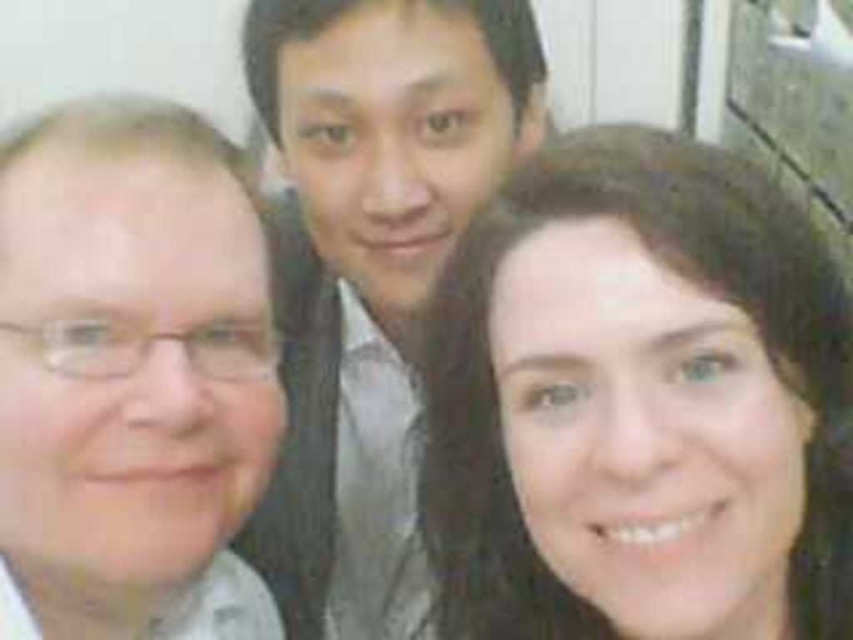
Is smooth brown hair at center shorter than matte gray shirt at center?

Yes.

The height and width of the screenshot is (640, 853). Find the location of `smooth brown hair at center`. smooth brown hair at center is located at coordinates (639, 403).

Find the location of a particular element. The height and width of the screenshot is (640, 853). smooth brown hair at center is located at coordinates (639, 403).